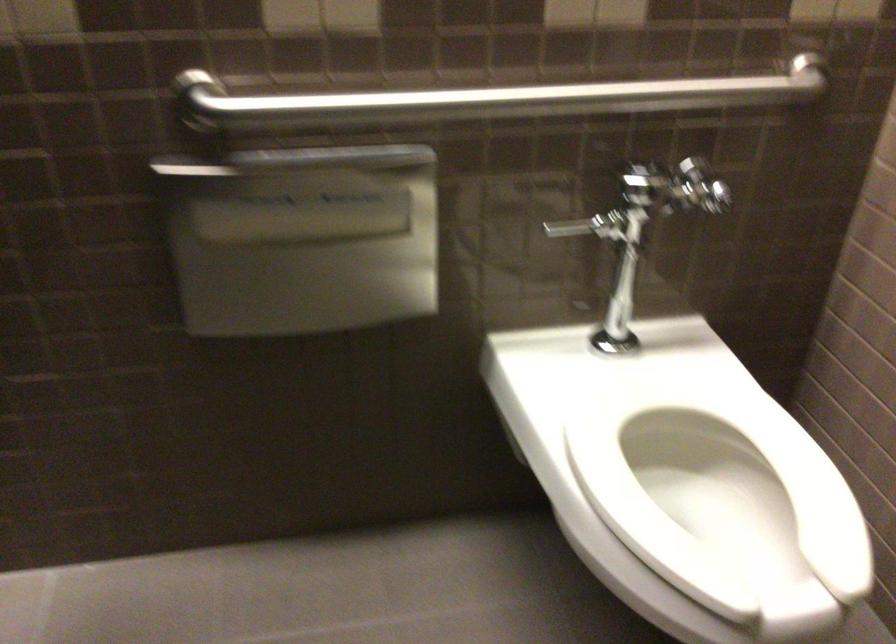
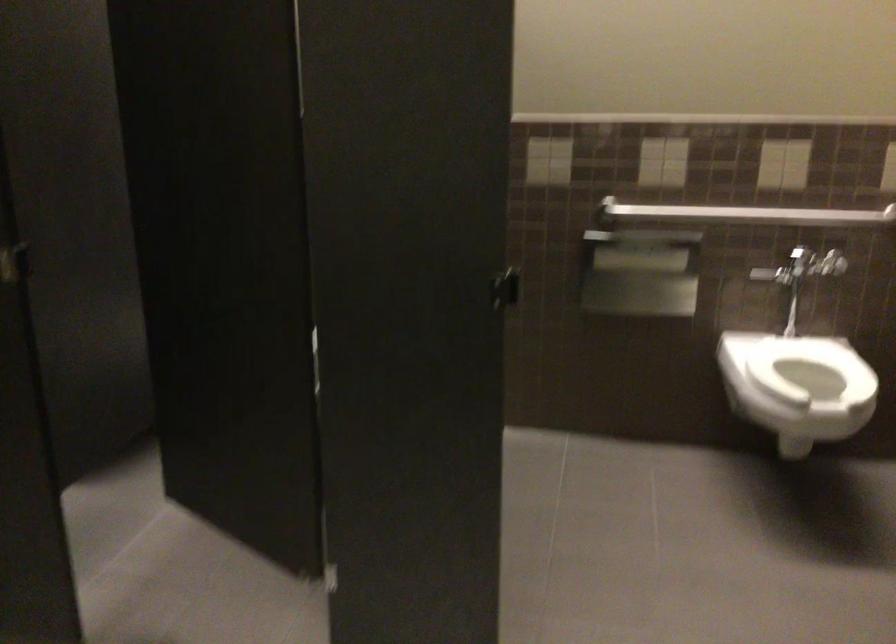
Question: What movement of the cameraman would produce the second image?

Choices:
 (A) Left
 (B) Right
 (C) Forward
 (D) Backward

Answer: (D)